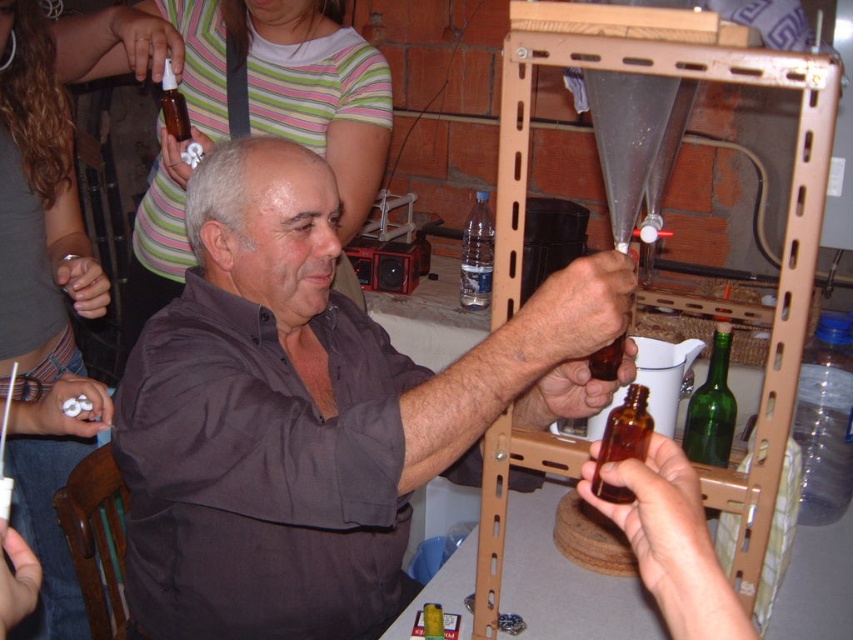
Question: Can you confirm if green glass bottle at center is thinner than translucent amber bottle at upper left?

Choices:
 (A) yes
 (B) no

Answer: (A)

Question: Among these objects, which one is nearest to the camera?

Choices:
 (A) transparent plastic bottle at center
 (B) matte brown shirt at center
 (C) transparent plastic bottle at right
 (D) green glass bottle at center

Answer: (B)

Question: Which of the following is the farthest from the observer?

Choices:
 (A) (614, 433)
 (B) (469, 212)
 (C) (804, 380)
 (D) (164, 104)

Answer: (B)

Question: Is matte brown shirt at center wider than green glass bottle at center?

Choices:
 (A) no
 (B) yes

Answer: (B)

Question: Among these objects, which one is farthest from the camera?

Choices:
 (A) matte brown shirt at center
 (B) transparent plastic bottle at right

Answer: (B)

Question: Is brown glass bottle at center to the right of transparent plastic bottle at center from the viewer's perspective?

Choices:
 (A) no
 (B) yes

Answer: (B)